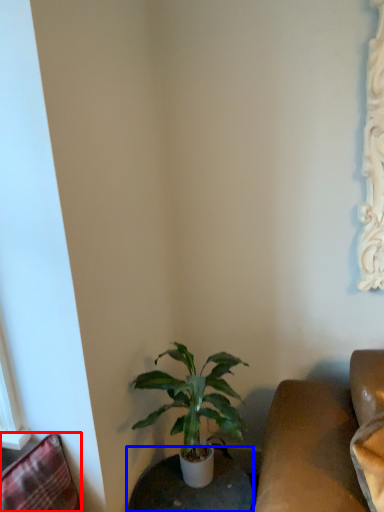
Question: Among these objects, which one is farthest to the camera, swivel chair (highlighted by a red box) or round table (highlighted by a blue box)?

Choices:
 (A) swivel chair
 (B) round table

Answer: (B)